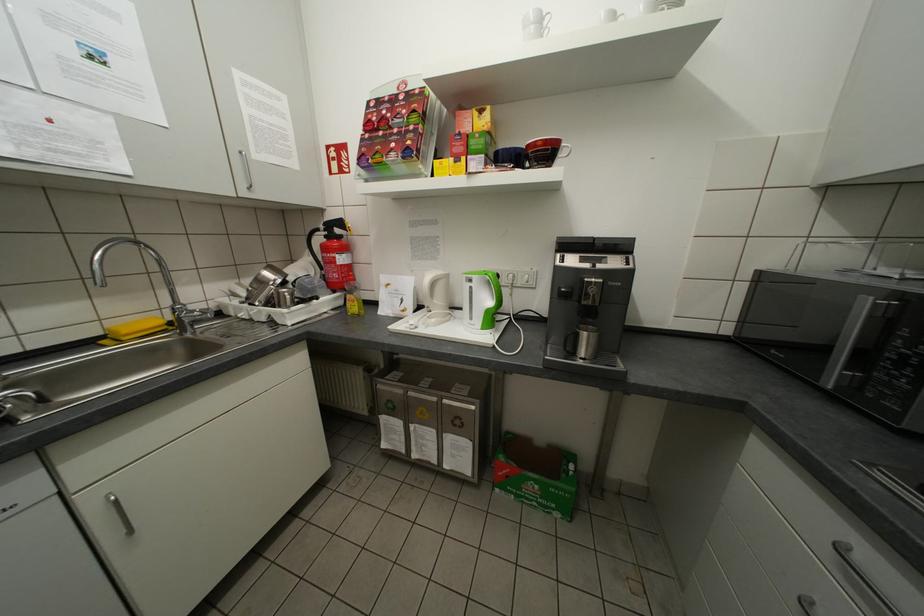
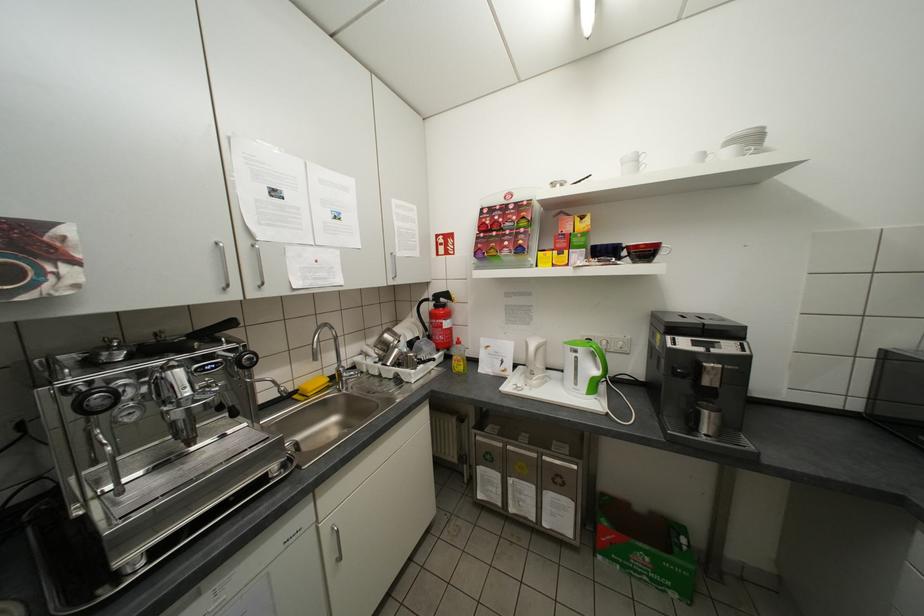
In the second image, find the point that corresponds to point (502, 166) in the first image.

(603, 259)